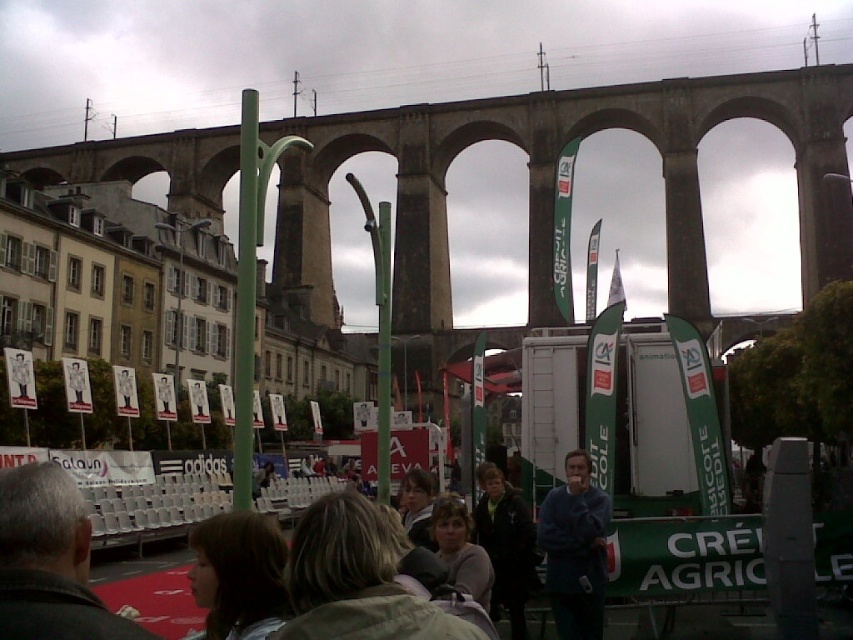
Does blonde hair at center appear under dark gray fabric crowd at center?

Actually, blonde hair at center is above dark gray fabric crowd at center.

Is point (360, 513) positioned after point (175, 595)?

That is False.

Image resolution: width=853 pixels, height=640 pixels. What are the coordinates of `blonde hair at center` in the screenshot? It's located at (355, 579).

Based on the photo, is dark brown leather jacket at lower left to the left of matte gray jacket at center from the viewer's perspective?

Yes, dark brown leather jacket at lower left is to the left of matte gray jacket at center.

Who is more forward, (79, 499) or (460, 582)?

Point (79, 499)

This screenshot has height=640, width=853. Identify the location of dark brown leather jacket at lower left. (49, 561).

Does dark green jacket at center lie in front of matte gray jacket at center?

No, it is behind matte gray jacket at center.

Does dark green jacket at center come behind matte gray jacket at center?

Yes, it is.

Is point (490, 520) positioned behind point (463, 541)?

Yes, it is behind point (463, 541).

Where is `dark green jacket at center`? The height and width of the screenshot is (640, 853). dark green jacket at center is located at coordinates (505, 545).